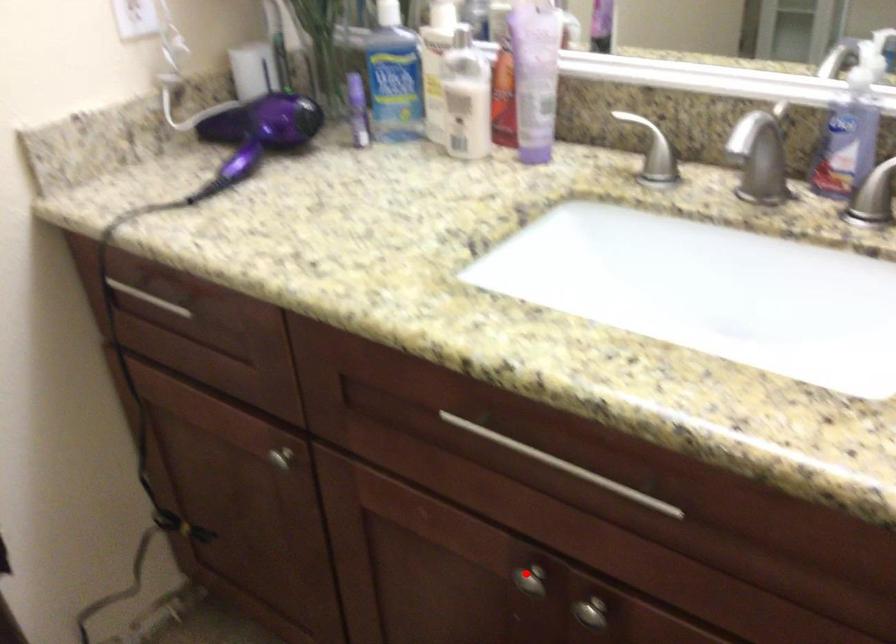
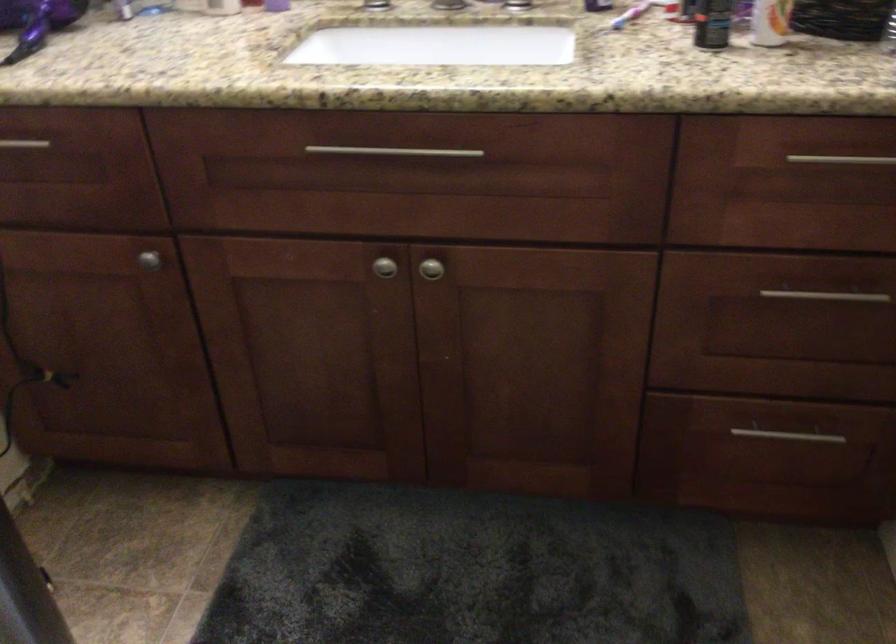
Question: I am providing you with two images of the same scene from different viewpoints. Image1 has a red point marked. In image2, the corresponding 3D location appears at what relative position? Reply with the corresponding letter.

Choices:
 (A) Closer
 (B) Farther

Answer: (B)